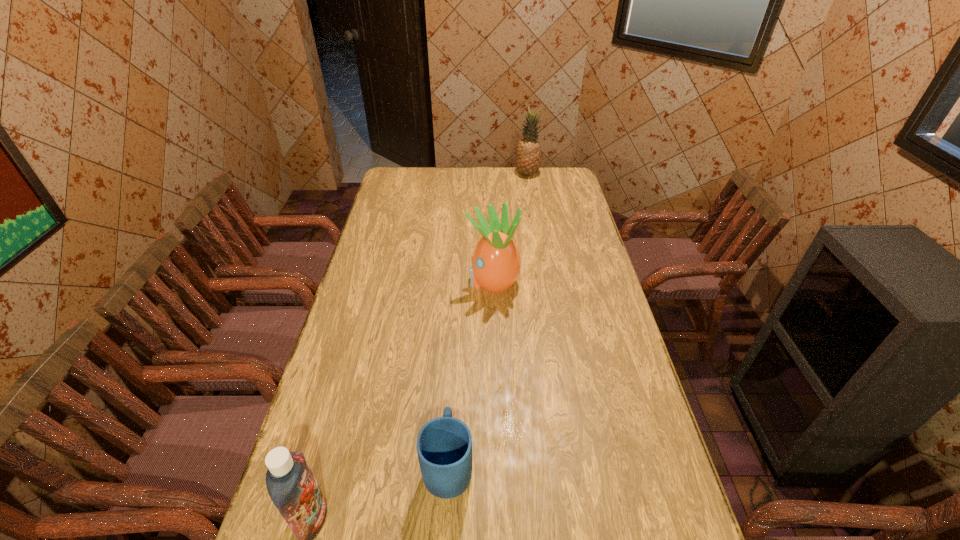
Identify the location of object that is the third closest one to the shampoo. (528, 152).

Locate which object ranks third in proximity to the farthest object. Please provide its 2D coordinates. Your answer should be formatted as a tuple, i.e. [(x, y)], where the tuple contains the x and y coordinates of a point satisfying the conditions above.

[(291, 485)]

At what (x,y) coordinates should I click in order to perform the action: click on free spot that satisfies the following two spatial constraints: 1. on the side of the shortest object with the handle; 2. on the left side of the rightmost object. Please return your answer as a coordinate pair (x, y). The image size is (960, 540). Looking at the image, I should click on pyautogui.click(x=465, y=174).